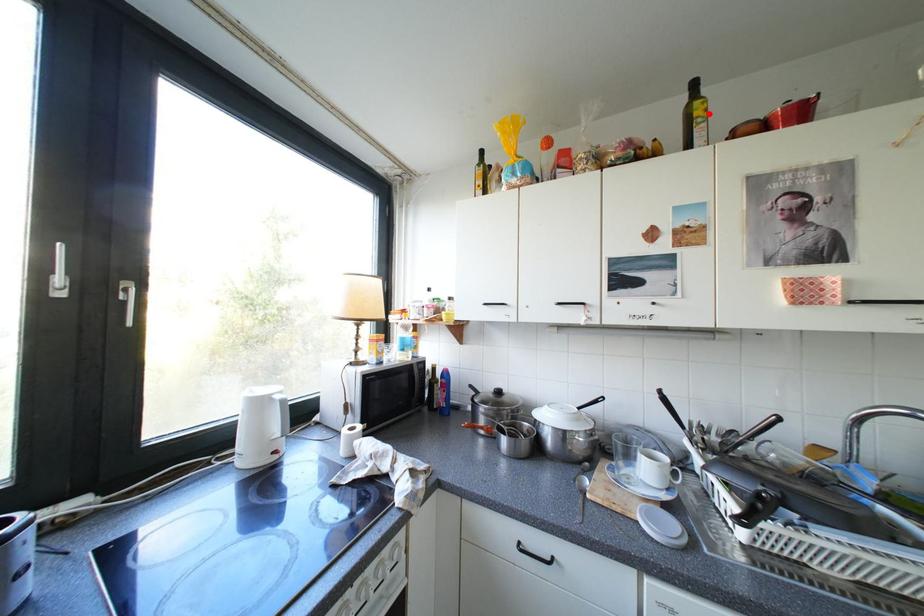
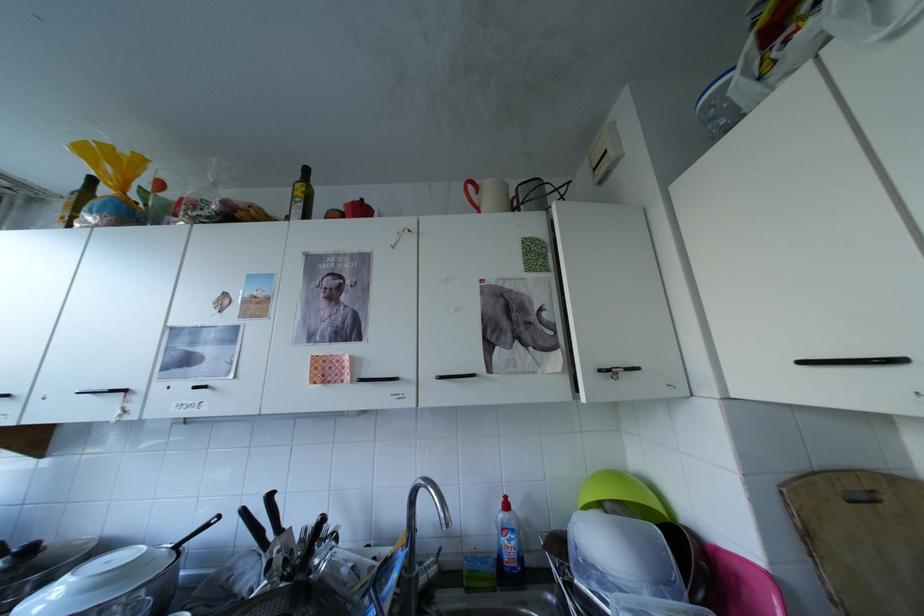
Locate, in the second image, the point that corresponds to the highlighted location in the first image.

(309, 193)